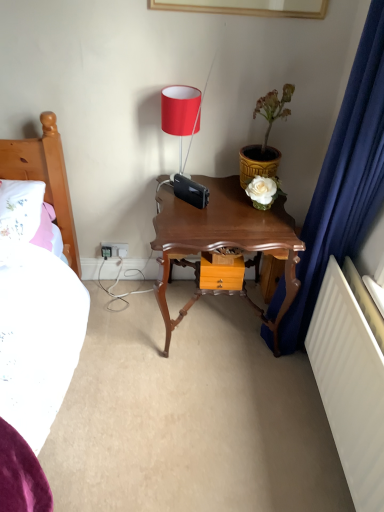
Locate an element on the screen. free space in front of matte red lampshade at upper center is located at coordinates (179, 205).